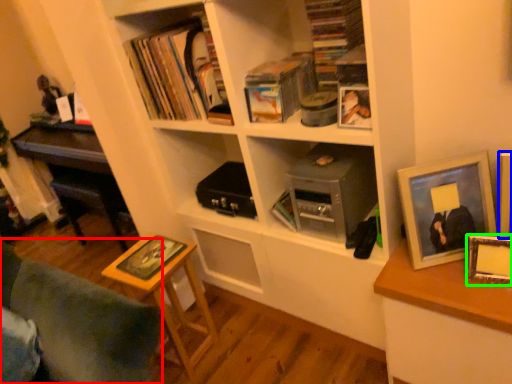
Question: Which object is positioned closest to furniture (highlighted by a red box)? Select from picture frame (highlighted by a blue box) and picture frame (highlighted by a green box).

Choices:
 (A) picture frame
 (B) picture frame

Answer: (B)